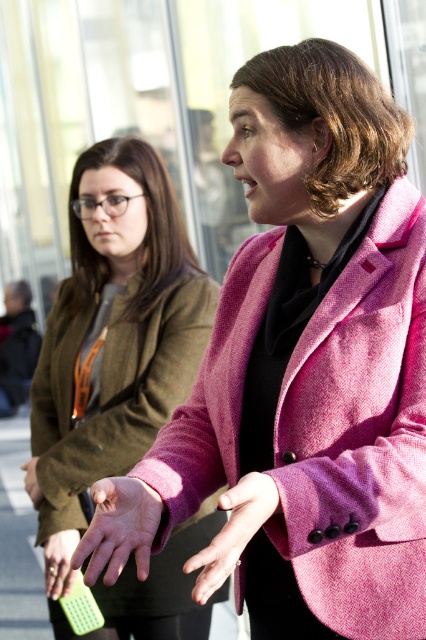
Does pink woolen coat at center have a greater width compared to pale skin hand at center?

Indeed, pink woolen coat at center has a greater width compared to pale skin hand at center.

Is pink woolen coat at center behind pale skin hand at center?

Yes, pink woolen coat at center is behind pale skin hand at center.

This screenshot has width=426, height=640. Describe the element at coordinates (359, 433) in the screenshot. I see `pink woolen coat at center` at that location.

Where is `pink woolen coat at center`? This screenshot has height=640, width=426. pink woolen coat at center is located at coordinates (359, 433).

Is the position of knitted wool coat at center less distant than that of matte green phone at lower left?

No, it is behind matte green phone at lower left.

Which of these two, knitted wool coat at center or matte green phone at lower left, stands taller?

knitted wool coat at center

Is point (69, 429) more distant than point (51, 566)?

Yes, it is behind point (51, 566).

Where is `knitted wool coat at center`? The height and width of the screenshot is (640, 426). knitted wool coat at center is located at coordinates (112, 390).

Between point (414, 499) and point (63, 536), which one is positioned in front?

Point (414, 499)

Is point (342, 497) closer to camera compared to point (51, 545)?

Yes, point (342, 497) is closer to viewer.

This screenshot has height=640, width=426. I want to click on pink woolen coat at center, so click(359, 433).